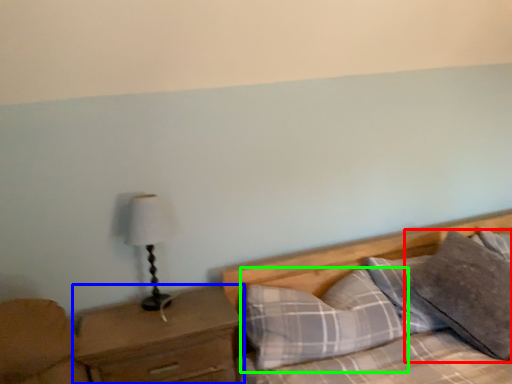
Question: Estimate the real-world distances between objects in this image. Which object is closer to pillow (highlighted by a red box), nightstand (highlighted by a blue box) or pillow (highlighted by a green box)?

Choices:
 (A) nightstand
 (B) pillow

Answer: (B)